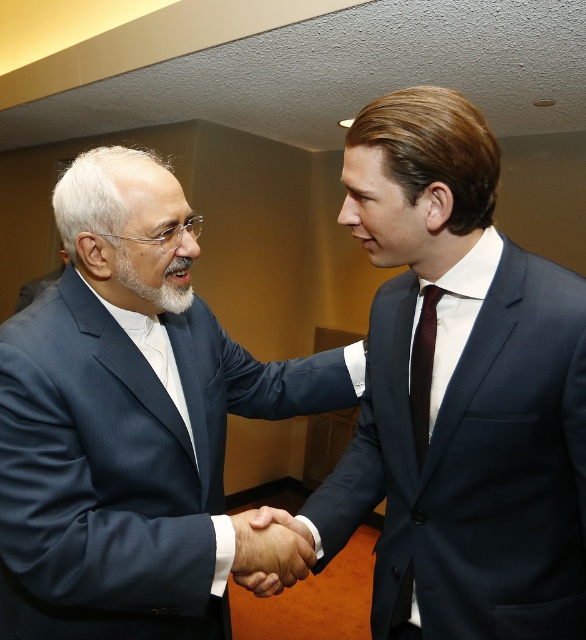
You are a photographer adjusting the camera settings to ensure both the white soft beard at center and the dark brown silk tie at center are in focus. Given their sizes, which one requires more careful framing to avoid being too large in the frame?

The white soft beard at center requires more careful framing because its width is larger than the dark brown silk tie at center, making it more likely to dominate the frame if not positioned properly.

You are an artist sketching the two men in the scene. You need to draw the white soft beard at center and the dark brown silk tie at center. Which object should you draw first if you want to follow the natural order from top to bottom?

The white soft beard at center should be drawn first because it is positioned above the dark brown silk tie at center.